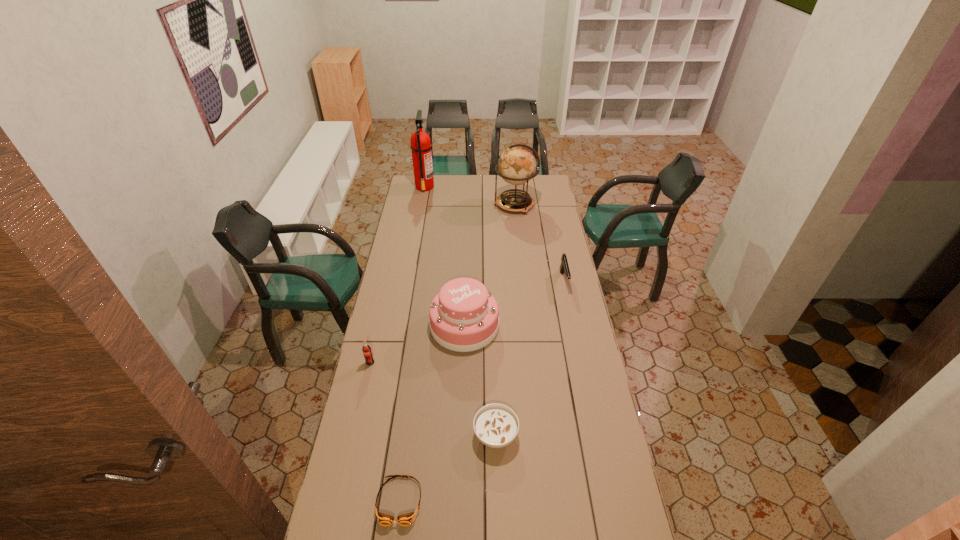
Identify the location of fire extinguisher present at the far edge. (420, 146).

The width and height of the screenshot is (960, 540). I want to click on globe situated at the far edge, so click(x=517, y=165).

I want to click on fire extinguisher located in the left edge section of the desktop, so click(420, 146).

The image size is (960, 540). Find the location of `soda bottle positioned at the left edge`. soda bottle positioned at the left edge is located at coordinates (366, 349).

You are a GUI agent. You are given a task and a screenshot of the screen. Output one action in this format:
    pyautogui.click(x=<x>, y=<y>)
    Task: Click on the goggles located in the left edge section of the desktop
    
    Given the screenshot: What is the action you would take?
    pyautogui.click(x=384, y=519)

Image resolution: width=960 pixels, height=540 pixels. Find the location of `globe located at the right edge`. globe located at the right edge is located at coordinates (517, 165).

I want to click on pistol located at the right edge, so click(x=564, y=267).

Identify the location of object that is at the far left corner. (420, 146).

At what (x,y) coordinates should I click in order to perform the action: click on object that is at the far right corner. Please return your answer as a coordinate pair (x, y). Looking at the image, I should click on (517, 165).

Find the location of a particular element. This screenshot has width=960, height=540. free space at the far edge of the desktop is located at coordinates (488, 193).